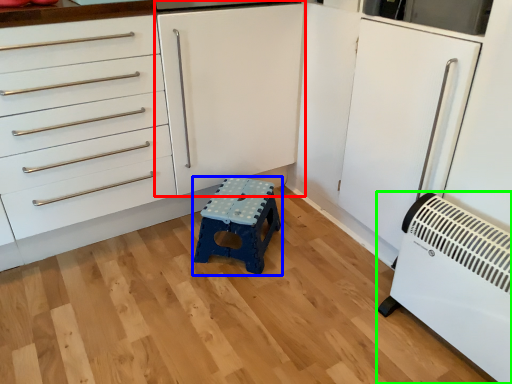
Question: Estimate the real-world distances between objects in this image. Which object is closer to cabinetry (highlighted by a red box), furniture (highlighted by a blue box) or home appliance (highlighted by a green box)?

Choices:
 (A) furniture
 (B) home appliance

Answer: (A)